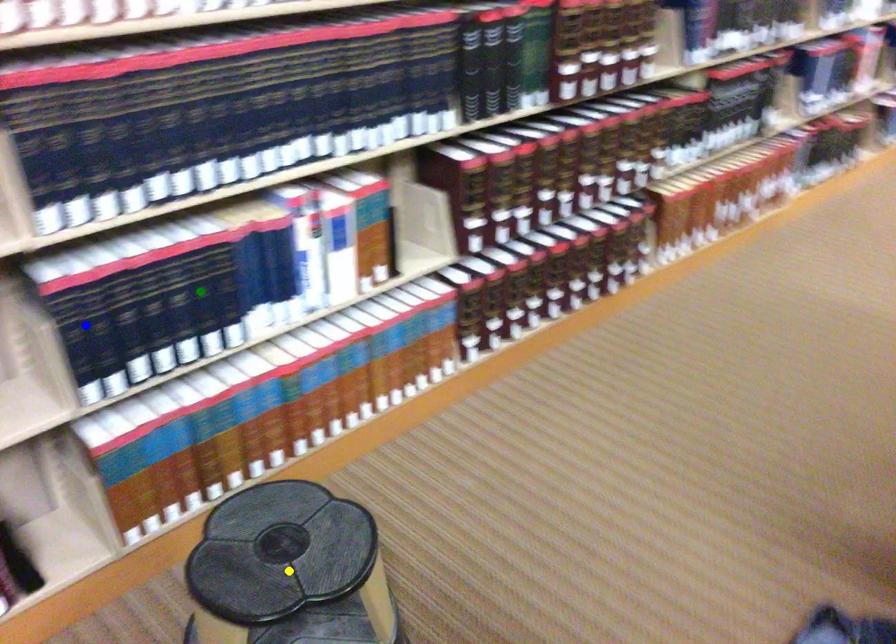
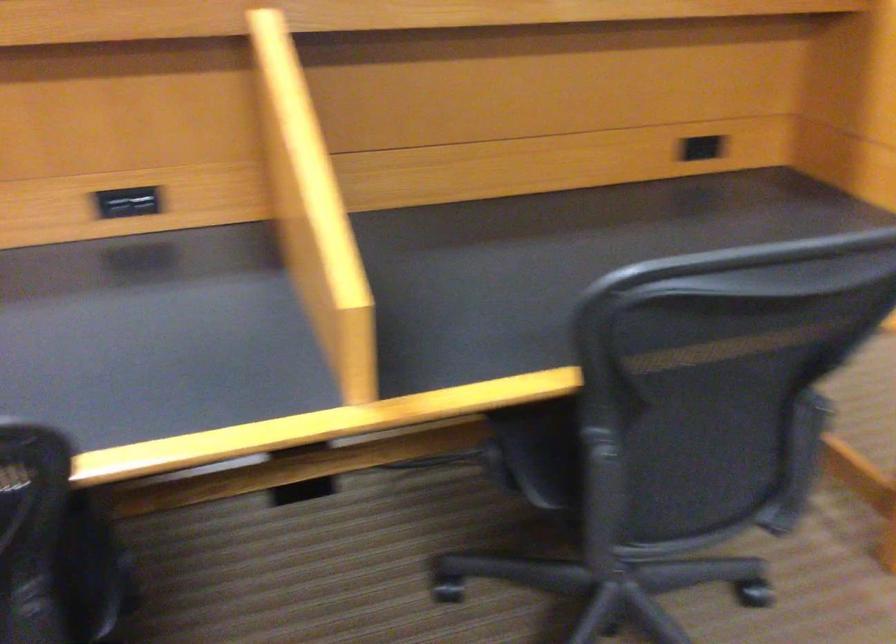
I am providing you with two images of the same scene from different viewpoints. Three points are marked in image1. Which point corresponds to a part or object that is occluded in image2?In image1, three points are marked. Which of them correspond to a part or object that is occluded in image2?Among the three points shown in image1, which one corresponds to a part or object that is no longer visible due to occlusion in image2?

green point, yellow point, blue point